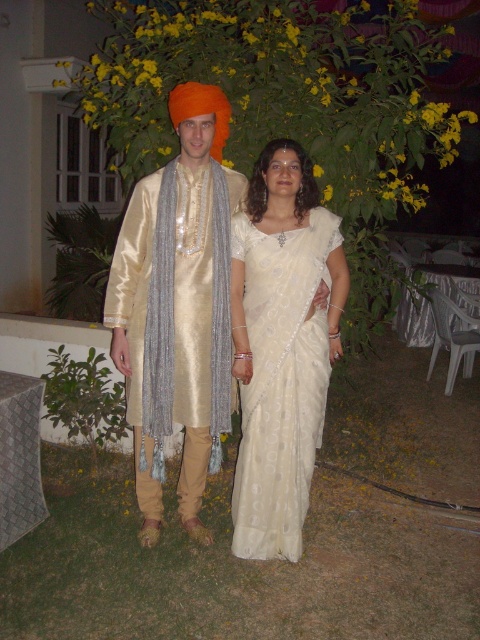
You are a photographer trying to capture a closeup of the silky beige kurta at center. The camera you are using has a focal length of 50mm. Based on the coordinates provided, can you determine if the kurta is positioned within the central 20x20 pixel area of the image?

The silky beige kurta at center is positioned at point (178, 307). Since the central 20x20 pixel area would be centered around the middle of the image, the kurta is located slightly to the right and above the center point, so it may not be perfectly centered but still within the central area depending on the exact pixel dimensions.

Consider the image. You are a photographer trying to frame a shot of the silky beige kurta at center and the white silk saree at center. Since you want to emphasize the size difference between them, which one should you zoom in on more?

The silky beige kurta at center is larger in size than the white silk saree at center, so you should zoom in more on the white silk saree at center to emphasize the size difference between them.